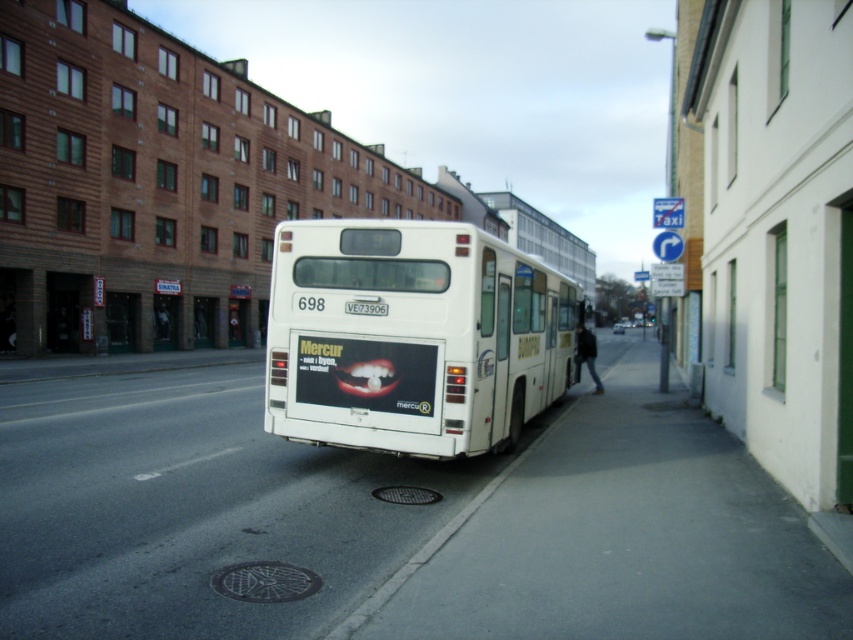
Does white matte bus at center have a lesser width compared to white plastic license plate at rear?

In fact, white matte bus at center might be wider than white plastic license plate at rear.

Who is more distant from viewer, (431,378) or (366,305)?

The point (366,305) is more distant.

Who is more distant from viewer, (x=526, y=307) or (x=357, y=304)?

Positioned behind is point (x=526, y=307).

You are a GUI agent. You are given a task and a screenshot of the screen. Output one action in this format:
    pyautogui.click(x=<x>, y=<y>)
    Task: Click on the white matte bus at center
    
    Given the screenshot: What is the action you would take?
    pyautogui.click(x=412, y=337)